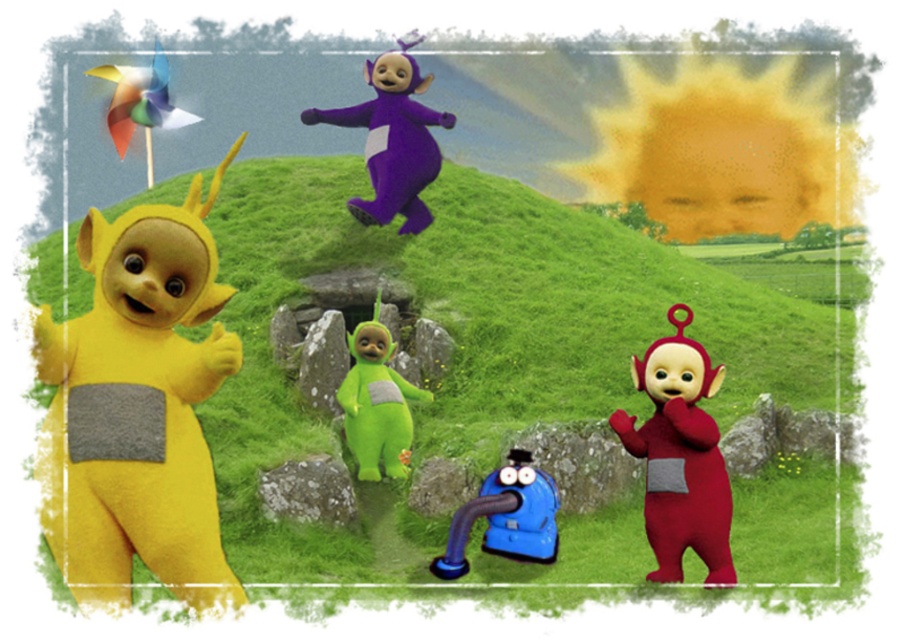
Question: Is purple plush toy at upper center to the right of rainbow plastic pinwheel at upper left from the viewer's perspective?

Choices:
 (A) yes
 (B) no

Answer: (A)

Question: Which object appears closest to the camera in this image?

Choices:
 (A) blue rubber toy at center
 (B) rainbow plastic pinwheel at upper left
 (C) matte red teletubby at right

Answer: (C)

Question: Can you confirm if purple plush toy at upper center is positioned below rainbow plastic pinwheel at upper left?

Choices:
 (A) yes
 (B) no

Answer: (A)

Question: Among these objects, which one is farthest from the camera?

Choices:
 (A) soft yellow plush at left
 (B) green felt teletubby at center
 (C) matte red teletubby at right
 (D) rainbow plastic pinwheel at upper left

Answer: (D)

Question: In this image, where is blue rubber toy at center located relative to rainbow plastic pinwheel at upper left?

Choices:
 (A) left
 (B) right

Answer: (B)

Question: Estimate the real-world distances between objects in this image. Which object is closer to the blue rubber toy at center?

Choices:
 (A) purple plush toy at upper center
 (B) rainbow plastic pinwheel at upper left
 (C) matte red teletubby at right
 (D) green felt teletubby at center

Answer: (C)